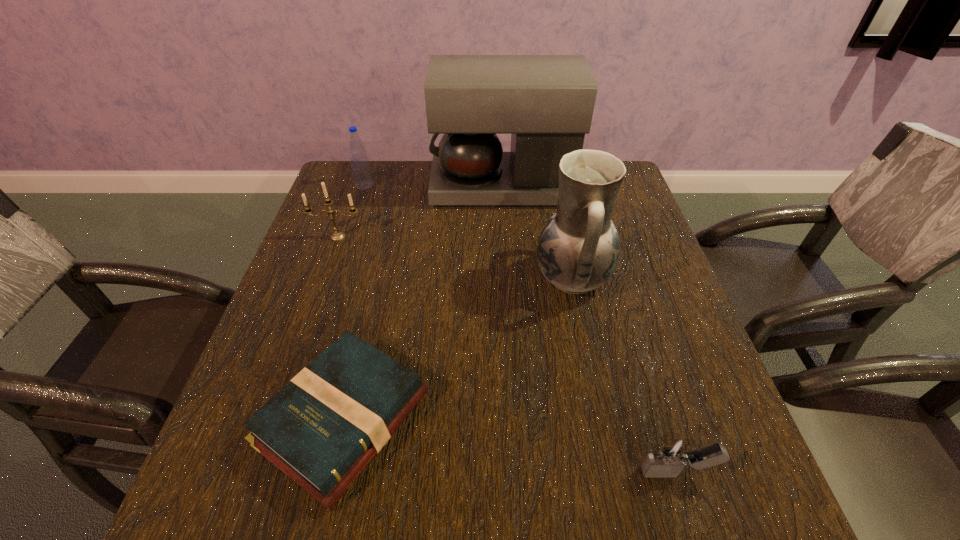
At what (x,y) coordinates should I click in order to perform the action: click on free space between the water bottle and the igniter. Please return your answer as a coordinate pair (x, y). Looking at the image, I should click on (520, 329).

Where is `free space between the fourth farthest object and the water bottle`? This screenshot has height=540, width=960. free space between the fourth farthest object and the water bottle is located at coordinates (468, 231).

This screenshot has width=960, height=540. I want to click on object that stands as the second closest to the hardback book, so click(337, 235).

The height and width of the screenshot is (540, 960). I want to click on object that stands as the fifth closest to the candle, so click(673, 452).

I want to click on free space that satisfies the following two spatial constraints: 1. on the carafe side of the igniter; 2. on the right side of the coffee maker, so click(521, 472).

Locate an element on the screen. This screenshot has width=960, height=540. vacant position in the image that satisfies the following two spatial constraints: 1. on the back side of the igniter; 2. on the front-facing side of the third nearest object is located at coordinates (616, 278).

You are a GUI agent. You are given a task and a screenshot of the screen. Output one action in this format:
    pyautogui.click(x=<x>, y=<y>)
    Task: Click on the vacant region that satisfies the following two spatial constraints: 1. on the carafe side of the coffee maker; 2. on the front side of the fourth nearest object
    The image size is (960, 540).
    Given the screenshot: What is the action you would take?
    pyautogui.click(x=506, y=237)